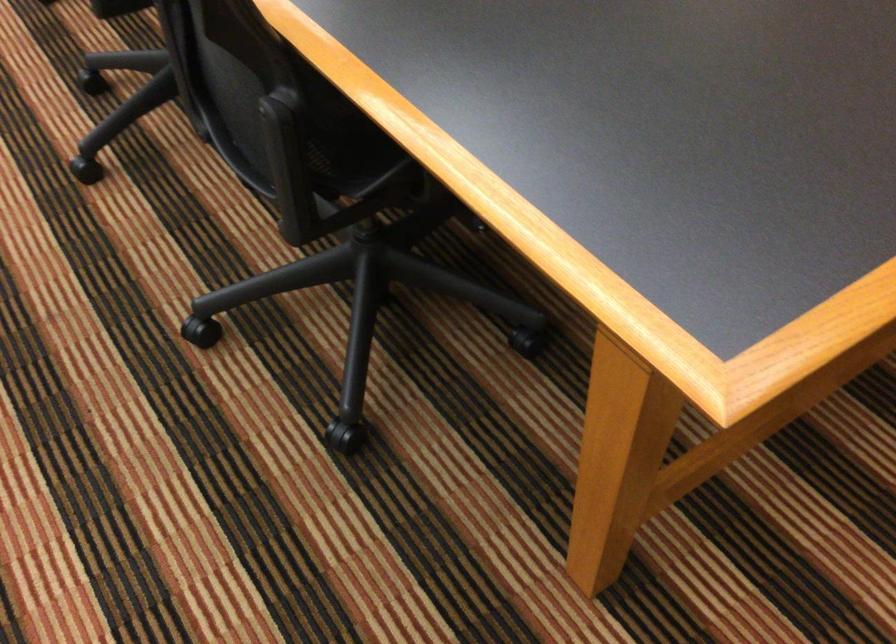
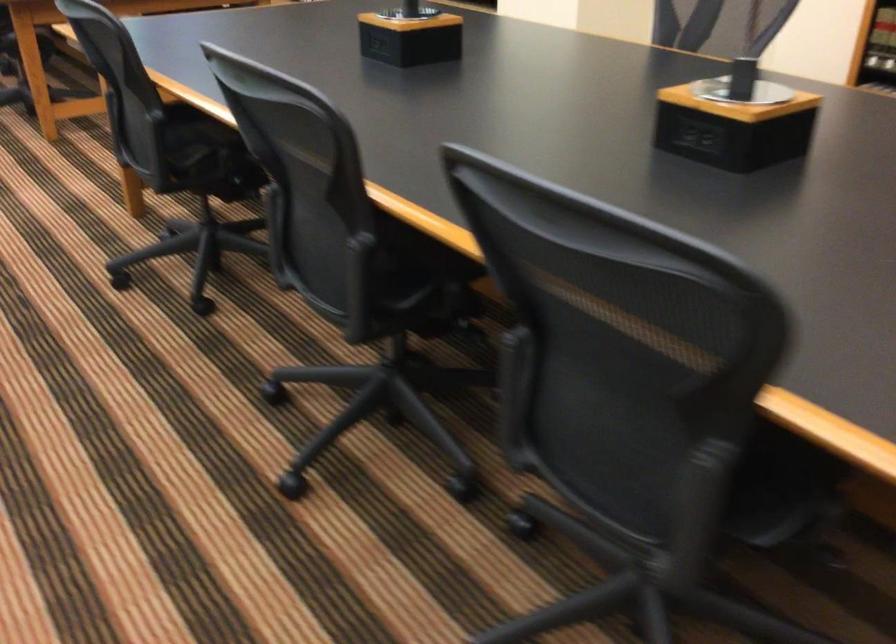
Question: The images are taken continuously from a first-person perspective. In which direction are you moving?

Choices:
 (A) Left
 (B) Right
 (C) Forward
 (D) Backward

Answer: (A)